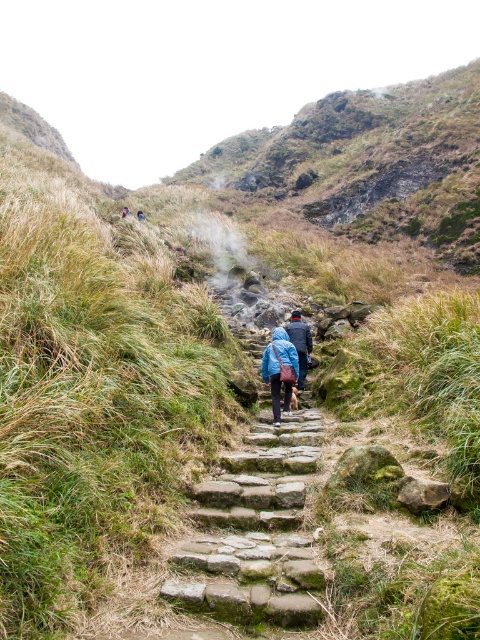
You are hiking along the rugged stone path and see the green mossy stone stairs at center and the blue fabric bag at center. Which object is located to the left of the other?

The green mossy stone stairs at center are to the left of the blue fabric bag at center.

You are a hiker planning to carry both the blue fabric bag at center and the blue fabric jacket at center. Which item has a greater width and is thus harder to fit into a narrow backpack compartment?

The blue fabric bag at center has a greater width than the blue fabric jacket at center, making it harder to fit into a narrow backpack compartment.

You are a hiker planning to walk along the stone path in the image. You have a 5 meter long rope that you need to cross between the green mossy stone stairs at center and the blue fabric jacket at center. Will your rope be long enough? Please explain.

The distance between the green mossy stone stairs at center and the blue fabric jacket at center is 5.15 meters. Since the rope is only 5 meters long, it will be 15 centimeters too short. Therefore, the rope will not be long enough.